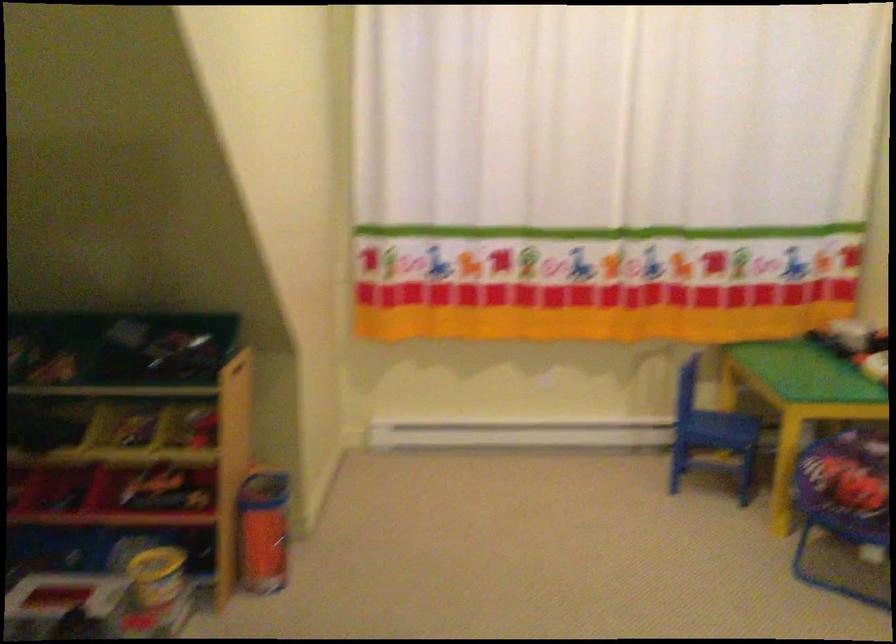
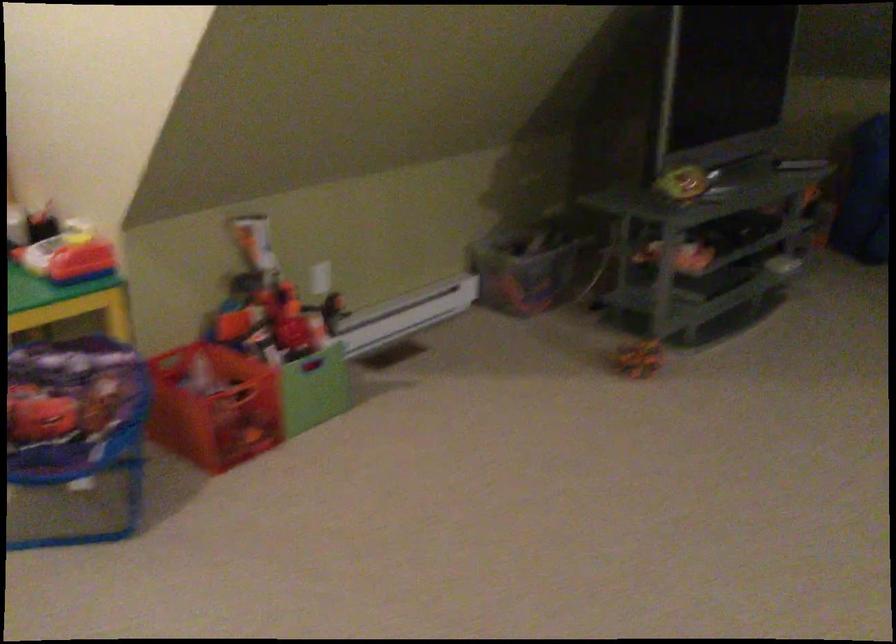
Question: The first image is from the beginning of the video and the second image is from the end. How did the camera likely rotate when shooting the video?

Choices:
 (A) Left
 (B) Right
 (C) Up
 (D) Down

Answer: (B)